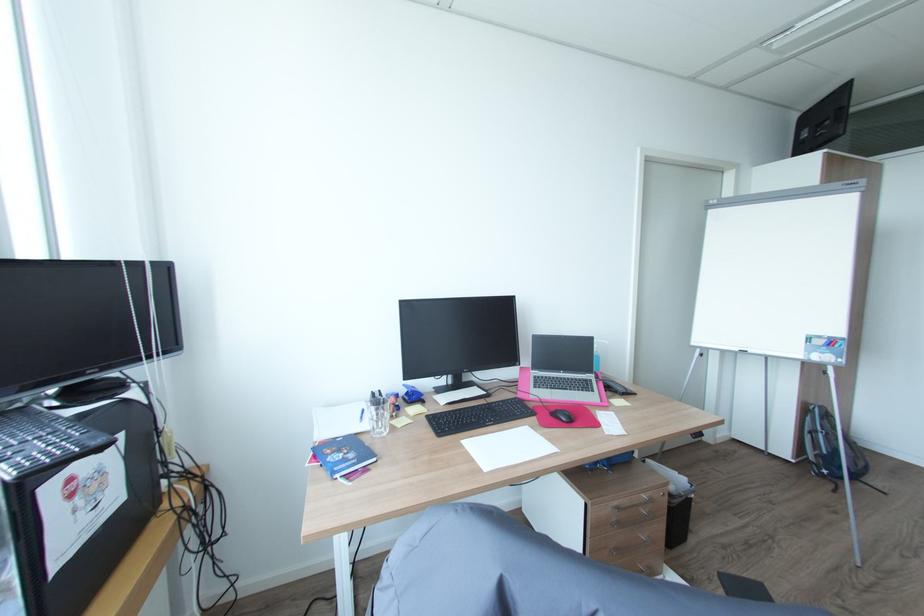
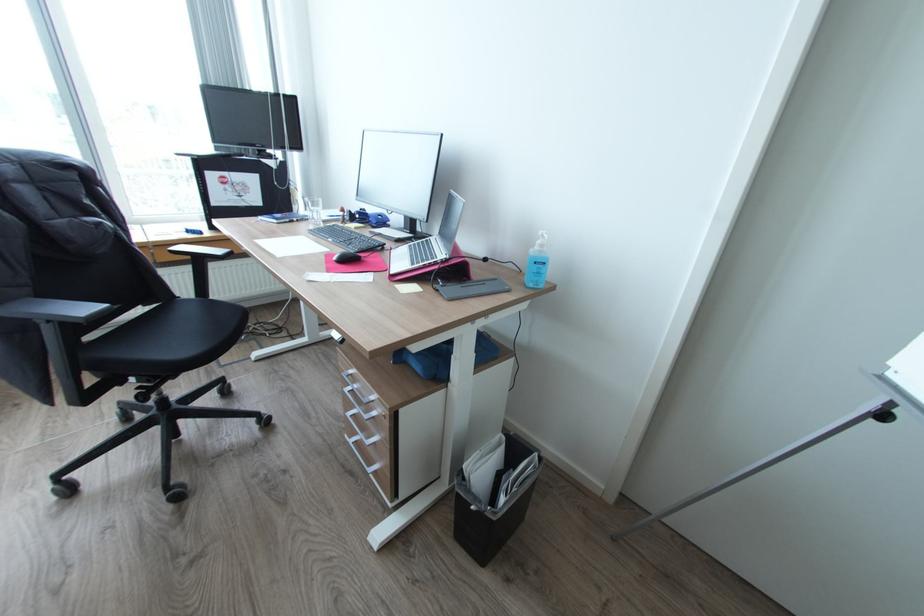
Where in the second image is the point corresponding to pixel 619 504 from the first image?

(357, 371)